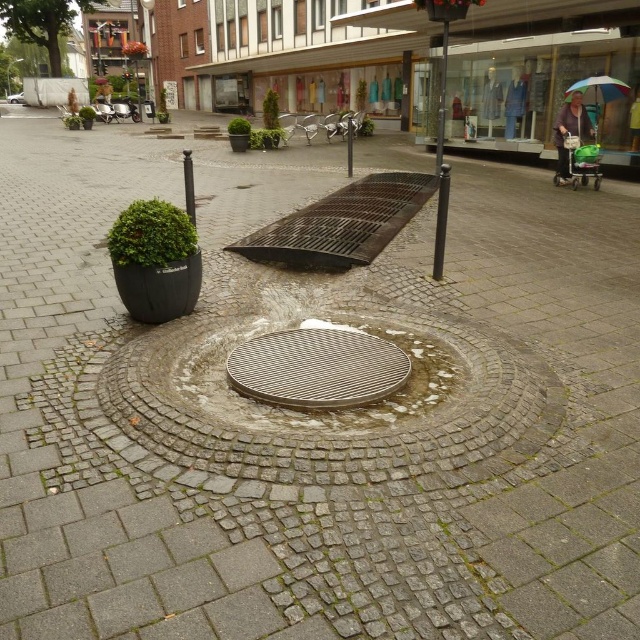
Question: Which of the following is the closest to the observer?

Choices:
 (A) (620, 84)
 (B) (374, 353)
 (C) (193, 180)

Answer: (B)

Question: Which of the following is the closest to the observer?

Choices:
 (A) metallic pole at center
 (B) black metal pole at center

Answer: (B)

Question: Estimate the real-world distances between objects in this image. Which object is closer to the metallic pole at center?

Choices:
 (A) black metal pole at center
 (B) rainbow fabric umbrella at upper right

Answer: (B)

Question: Is the position of metallic pole at center more distant than that of rainbow fabric umbrella at upper right?

Choices:
 (A) yes
 (B) no

Answer: (B)

Question: Does metallic grid manhole at center have a larger size compared to metallic pole at center?

Choices:
 (A) yes
 (B) no

Answer: (B)

Question: Is metallic grid manhole at center in front of metallic pole at center?

Choices:
 (A) no
 (B) yes

Answer: (B)